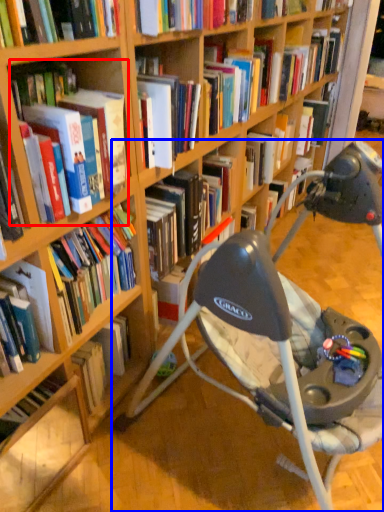
Question: Which point is closer to the camera, book (highlighted by a red box) or chair (highlighted by a blue box)?

Choices:
 (A) book
 (B) chair

Answer: (B)